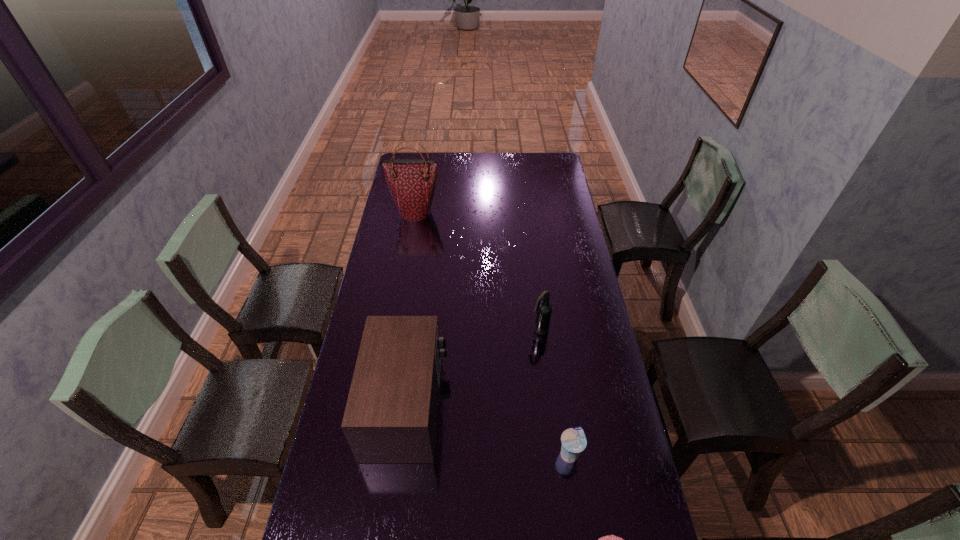
Find the location of a particular element. This screenshot has width=960, height=540. radio receiver located at the left edge is located at coordinates (391, 413).

Locate an element on the screen. Image resolution: width=960 pixels, height=540 pixels. object that is at the right edge is located at coordinates (573, 440).

In the image, there is a desktop. Where is `vacant space at the far edge`? The width and height of the screenshot is (960, 540). vacant space at the far edge is located at coordinates 461,159.

In the image, there is a desktop. At what (x,y) coordinates should I click in order to perform the action: click on free region at the left edge. Please return your answer as a coordinate pair (x, y). This screenshot has width=960, height=540. Looking at the image, I should click on (413, 251).

You are a GUI agent. You are given a task and a screenshot of the screen. Output one action in this format:
    pyautogui.click(x=<x>, y=<y>)
    Task: Click on the vacant space at the right edge of the desktop
    This screenshot has width=960, height=540.
    Given the screenshot: What is the action you would take?
    pyautogui.click(x=564, y=280)

The width and height of the screenshot is (960, 540). I want to click on vacant point at the far right corner, so click(x=549, y=161).

Locate an element on the screen. This screenshot has width=960, height=540. vacant space that's between the radio receiver and the beer bottle is located at coordinates (473, 368).

The height and width of the screenshot is (540, 960). I want to click on free space between the fourth tallest object and the second farthest object, so pyautogui.click(x=555, y=392).

At what (x,y) coordinates should I click in order to perform the action: click on vacant space in between the beer bottle and the handbag. Please return your answer as a coordinate pair (x, y). The height and width of the screenshot is (540, 960). Looking at the image, I should click on (477, 271).

Where is `vacant region between the yogurt and the farthest object`? This screenshot has height=540, width=960. vacant region between the yogurt and the farthest object is located at coordinates (492, 333).